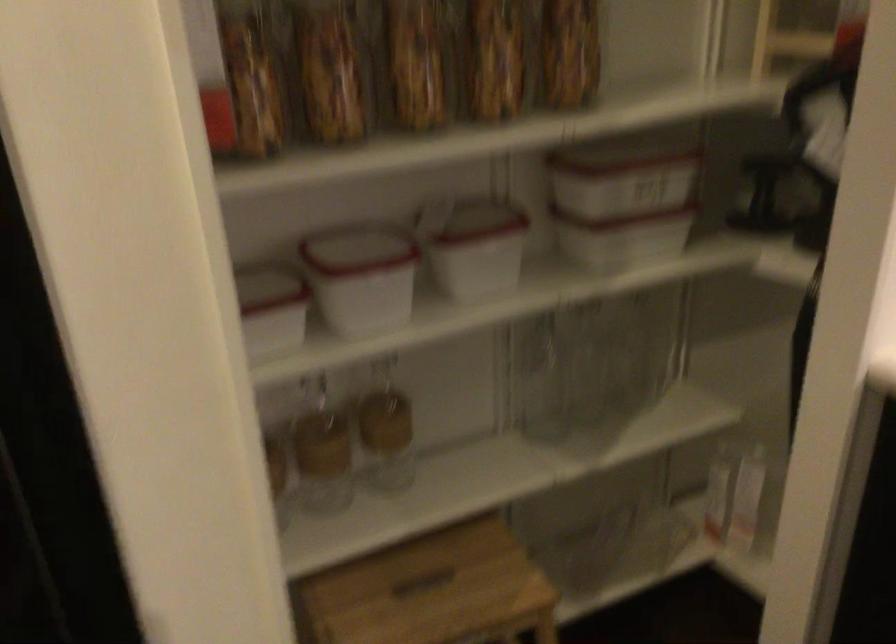
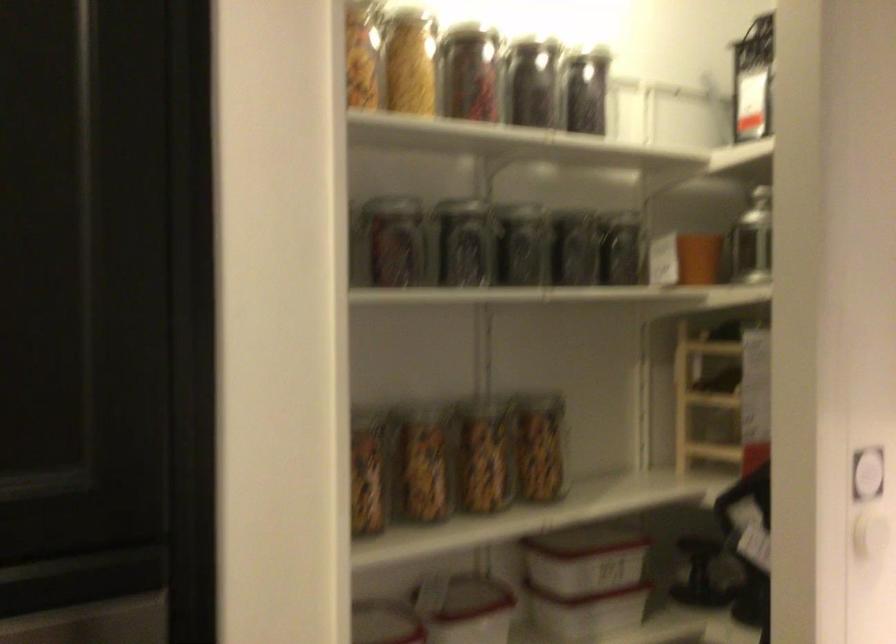
Locate, in the second image, the point that corresponds to the point at 641,242 in the first image.

(607, 614)